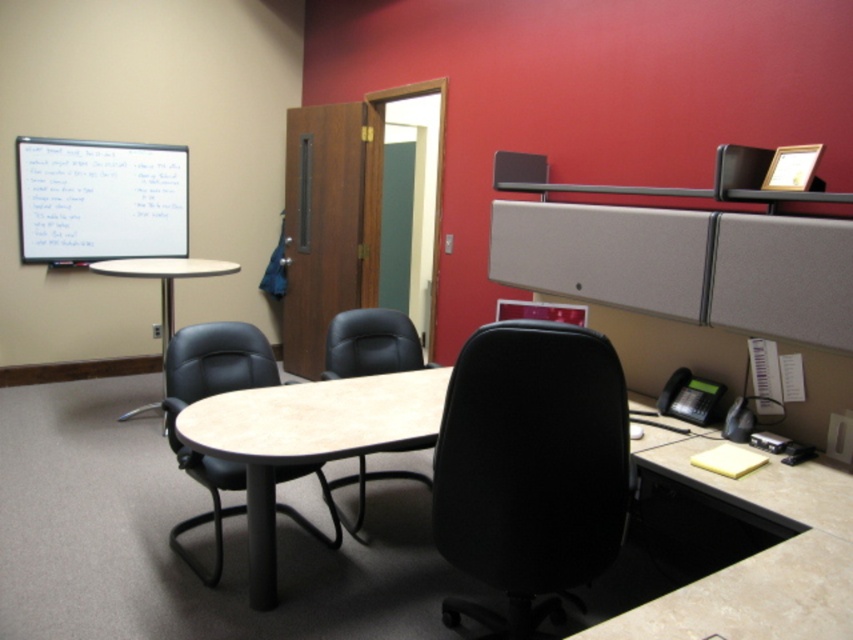
Question: Can you confirm if beige laminate desk at center is positioned to the left of matte black monitor at upper center?

Choices:
 (A) no
 (B) yes

Answer: (B)

Question: Is beige laminate desk at center to the right of matte black monitor at upper center from the viewer's perspective?

Choices:
 (A) no
 (B) yes

Answer: (A)

Question: Does beige laminate desk at center have a lesser width compared to white matte projection screen at upper left?

Choices:
 (A) no
 (B) yes

Answer: (B)

Question: Which is farther from the black leather swivel chair at center?

Choices:
 (A) metallic silver table at center
 (B) matte black monitor at upper center
 (C) black fabric swivel chair at center
 (D) white matte projection screen at upper left

Answer: (D)

Question: Among these objects, which one is farthest from the camera?

Choices:
 (A) black fabric swivel chair at center
 (B) metallic silver table at center
 (C) beige laminate desk at center
 (D) black leather swivel chair at center

Answer: (B)

Question: Which object is closer to the camera taking this photo?

Choices:
 (A) matte black monitor at upper center
 (B) beige laminate desk at center
 (C) black fabric swivel chair at center

Answer: (C)